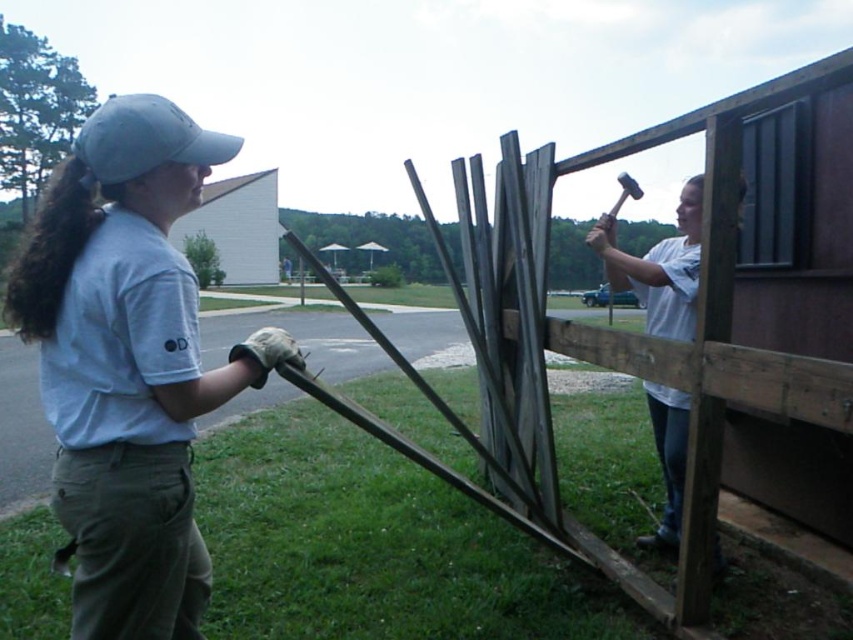
Question: In this image, where is light gray cotton cap at upper left located relative to white matte hammer at upper right?

Choices:
 (A) right
 (B) left

Answer: (B)

Question: Which point is closer to the camera?

Choices:
 (A) (631, 273)
 (B) (148, 145)
 (C) (93, 468)

Answer: (C)

Question: Does light gray cotton cap at upper left have a greater width compared to gray fabric baseball cap at upper left?

Choices:
 (A) no
 (B) yes

Answer: (A)

Question: Which of the following is the closest to the observer?

Choices:
 (A) (688, 316)
 (B) (167, 513)

Answer: (B)

Question: Is light gray cotton cap at upper left above white matte hammer at upper right?

Choices:
 (A) yes
 (B) no

Answer: (A)

Question: Which object appears farthest from the camera in this image?

Choices:
 (A) white matte hammer at upper right
 (B) gray fabric baseball cap at upper left

Answer: (A)